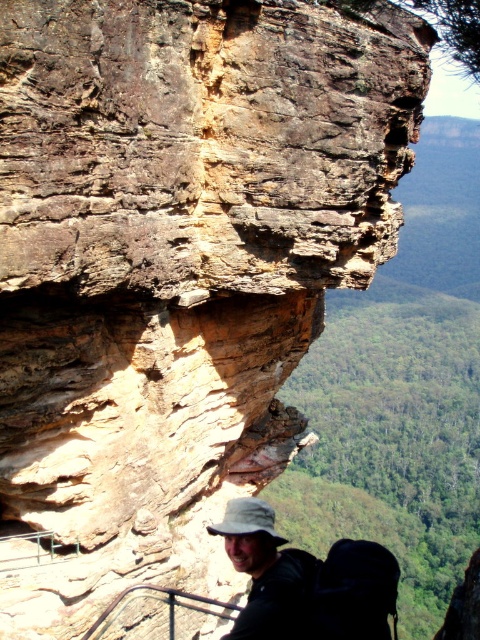
Does point (235, 552) come farther from viewer compared to point (252, 522)?

No, (235, 552) is closer to viewer.

Does matte khaki hat at lower center come in front of khaki fabric hat at center?

That is False.

The width and height of the screenshot is (480, 640). Identify the location of matte khaki hat at lower center. (266, 573).